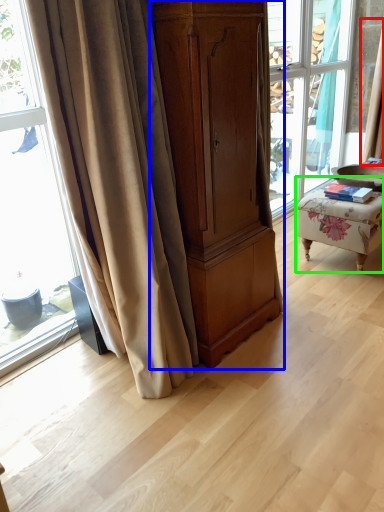
Question: Considering the real-world distances, which object is farthest from curtain (highlighted by a red box)? cabinetry (highlighted by a blue box) or furniture (highlighted by a green box)?

Choices:
 (A) cabinetry
 (B) furniture

Answer: (A)